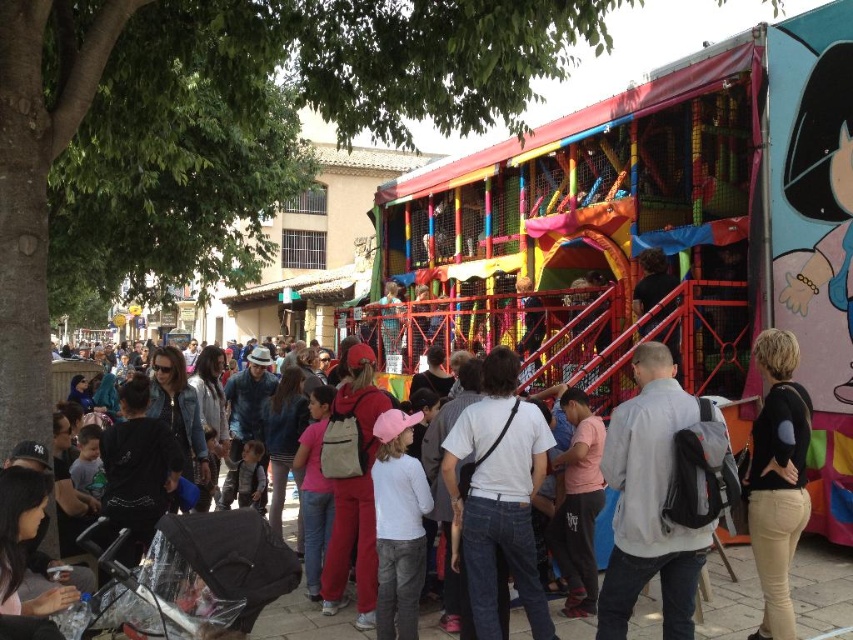
Who is more forward, (671, 412) or (529, 458)?

Point (671, 412) is more forward.

Locate an element on the screen. white cotton shirt at center is located at coordinates (500, 497).

Does multicolored plastic playhouse at center appear on the left side of gray fabric backpack at center?

Yes, multicolored plastic playhouse at center is to the left of gray fabric backpack at center.

The width and height of the screenshot is (853, 640). What are the coordinates of `multicolored plastic playhouse at center` in the screenshot? It's located at (665, 227).

Is multicolored plastic playhouse at center above black matte sweater at center?

Yes, multicolored plastic playhouse at center is above black matte sweater at center.

Is multicolored plastic playhouse at center bigger than black matte sweater at center?

Yes.

Find the location of a particular element. This screenshot has height=640, width=853. multicolored plastic playhouse at center is located at coordinates (665, 227).

Locate an element on the screen. The image size is (853, 640). multicolored plastic playhouse at center is located at coordinates (665, 227).